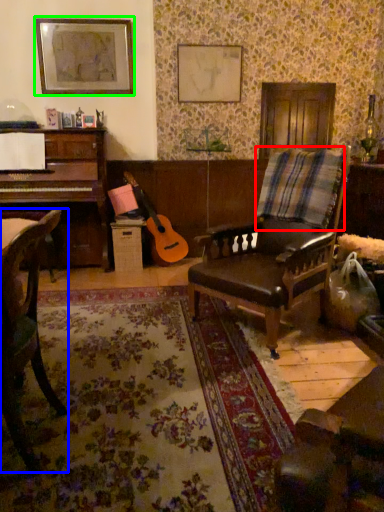
Question: Which object is positioned closest to plaid (highlighted by a red box)? Select from chair (highlighted by a blue box) and picture frame (highlighted by a green box).

Choices:
 (A) chair
 (B) picture frame

Answer: (A)